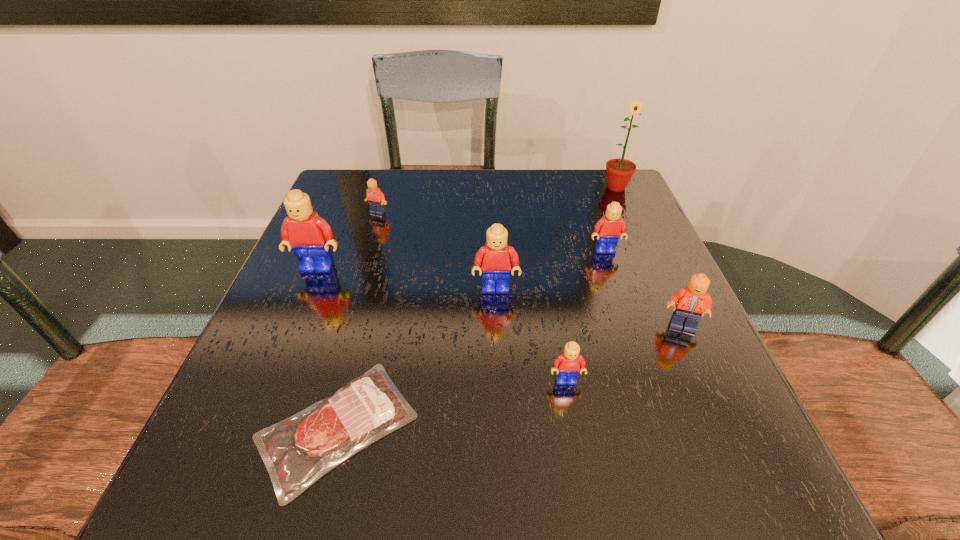
The height and width of the screenshot is (540, 960). In order to click on Lego that is the fifth closest to the green sunflower in this screenshot , I will do `click(567, 365)`.

You are a GUI agent. You are given a task and a screenshot of the screen. Output one action in this format:
    pyautogui.click(x=<x>, y=<y>)
    Task: Click on the second closest yellow Lego to the fourth nearest object
    Image resolution: width=960 pixels, height=540 pixels.
    Given the screenshot: What is the action you would take?
    pyautogui.click(x=567, y=365)

Identify the location of the third closest yellow Lego to the third farthest object. (309, 235).